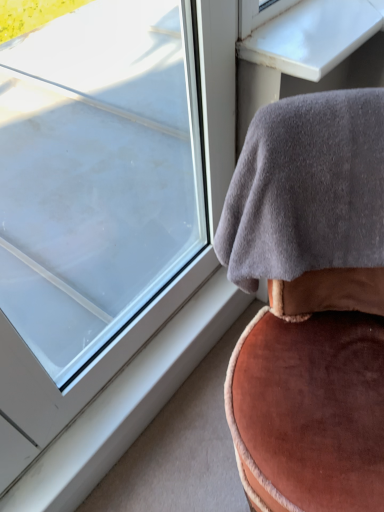
You are a GUI agent. You are given a task and a screenshot of the screen. Output one action in this format:
    pyautogui.click(x=<x>, y=<y>)
    Task: Click on the vacant space situated above white glossy table at upper right (from a real-world perspective)
    The width and height of the screenshot is (384, 512).
    Given the screenshot: What is the action you would take?
    pyautogui.click(x=322, y=21)